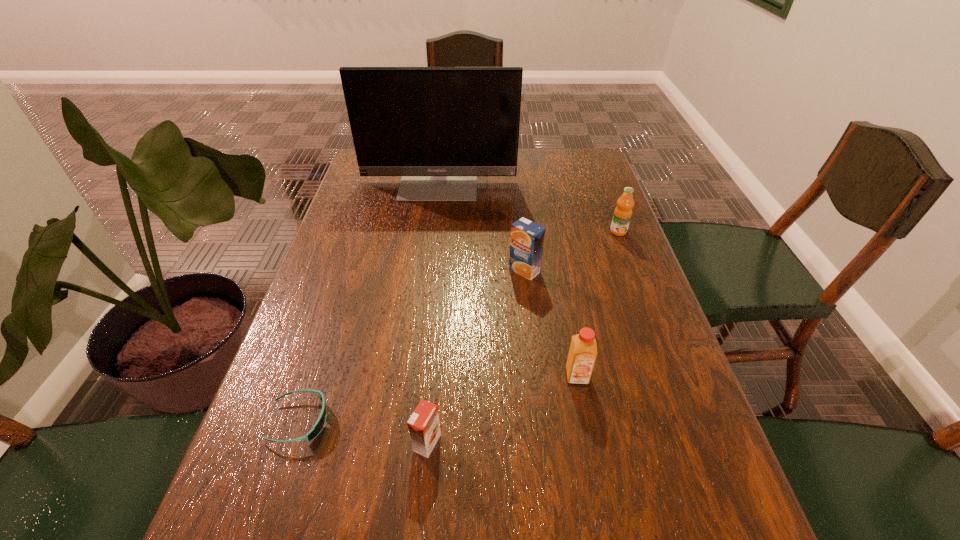
I want to click on free point between the second object from right to left and the second orange juice from left to right, so click(x=551, y=323).

Find the location of a particular element. This screenshot has width=960, height=540. free space between the sunglasses and the fifth object from left to right is located at coordinates (438, 399).

You are a GUI agent. You are given a task and a screenshot of the screen. Output one action in this format:
    pyautogui.click(x=<x>, y=<y>)
    Task: Click on the empty space between the second farthest orange juice and the nearest orange juice
    Image resolution: width=960 pixels, height=540 pixels.
    Given the screenshot: What is the action you would take?
    pyautogui.click(x=476, y=356)

Where is `free point between the rightmost orange juice and the sunglasses`? The height and width of the screenshot is (540, 960). free point between the rightmost orange juice and the sunglasses is located at coordinates (459, 326).

Identify the location of free spot between the nearest orange juice and the computer monitor. This screenshot has height=540, width=960. (433, 312).

Identify which object is the fifth closest to the second shortest object. Please provide its 2D coordinates. Your answer should be formatted as a tuple, i.e. [(x, y)], where the tuple contains the x and y coordinates of a point satisfying the conditions above.

[(439, 128)]

Image resolution: width=960 pixels, height=540 pixels. I want to click on object that stands as the second closest to the fifth object from left to right, so click(x=424, y=427).

What are the coordinates of `the third closest orange juice relative to the third nearest object` in the screenshot? It's located at (623, 211).

Choose which orange juice is the nearest neighbor to the sunglasses. Please provide its 2D coordinates. Your answer should be formatted as a tuple, i.e. [(x, y)], where the tuple contains the x and y coordinates of a point satisfying the conditions above.

[(424, 427)]

At what (x,y) coordinates should I click in order to perform the action: click on vacant space that satisfies the following two spatial constraints: 1. on the front and back of the second orange juice from right to left; 2. on the front-facing side of the sunglasses. Please return your answer as a coordinate pair (x, y). Image resolution: width=960 pixels, height=540 pixels. Looking at the image, I should click on (586, 421).